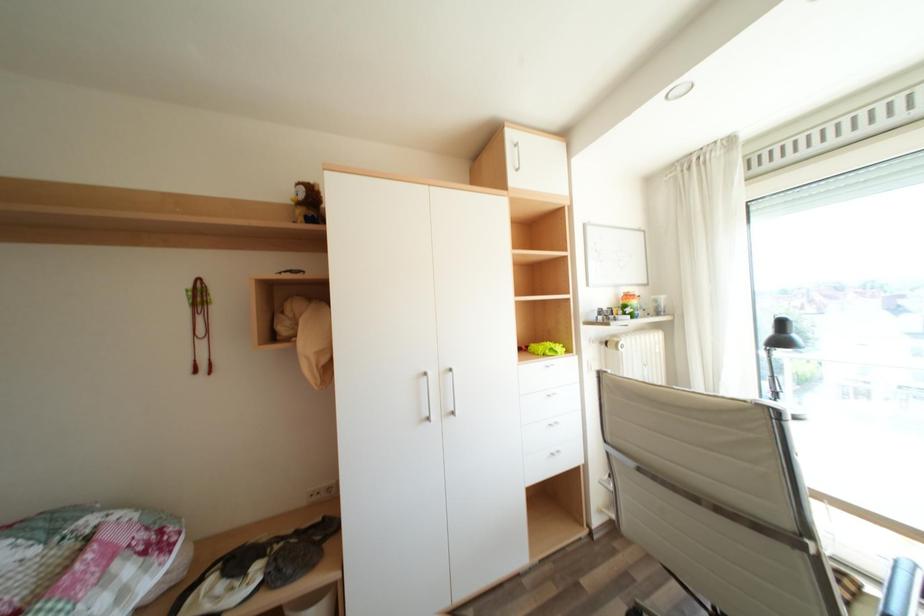
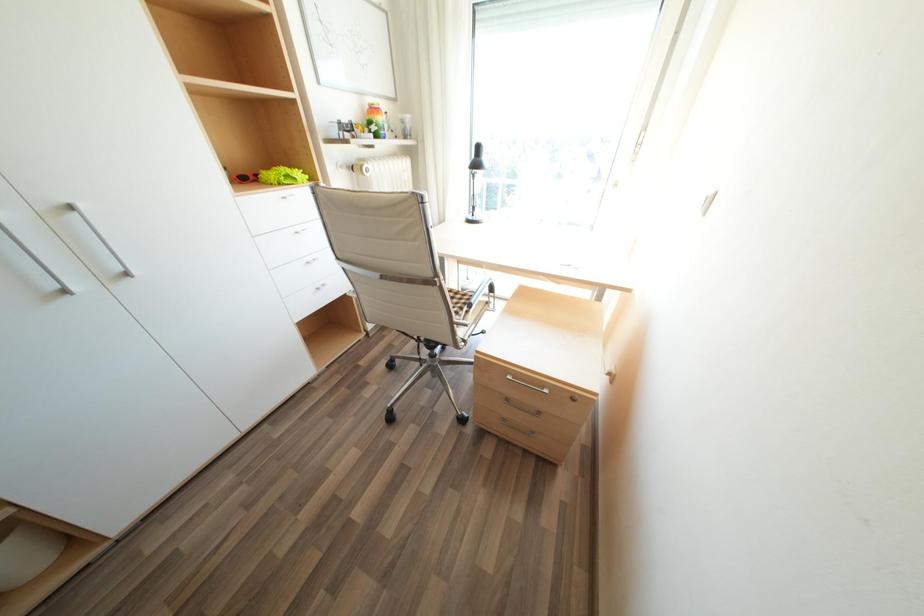
The images are taken continuously from a first-person perspective. In which direction is your viewpoint rotating?

The camera's rotation is toward right-down.